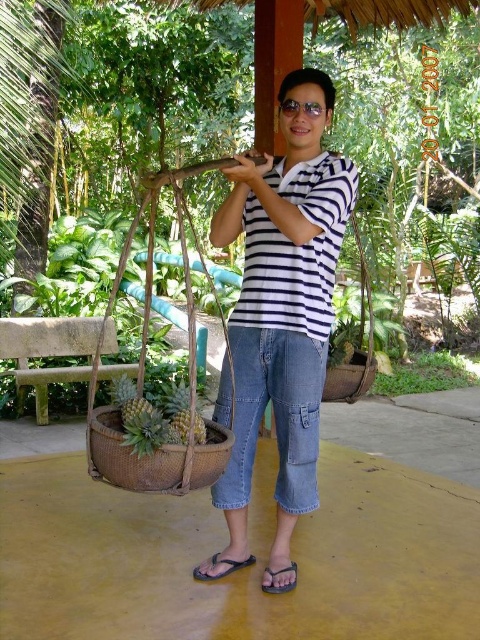
You are a photographer setting up a shot of the scene. You need to ensure that the green leafy plant at lower right and the black rubber sandal at lower center are both in frame. Which object should you adjust your camera angle to prioritize if you can only focus on one due to limited space?

The green leafy plant at lower right should be prioritized because it might be wider than the black rubber sandal at lower center, requiring more space in the frame.

You are a delivery person who needs to place a heavy package on the ground. You see the woven brown basket at lower center and the brown woven basket at lower right. Which basket should you place the package under to avoid blocking the basket above it?

You should place the package under the woven brown basket at lower center because it is positioned under the brown woven basket at lower right, so placing it there would not block the basket above it.